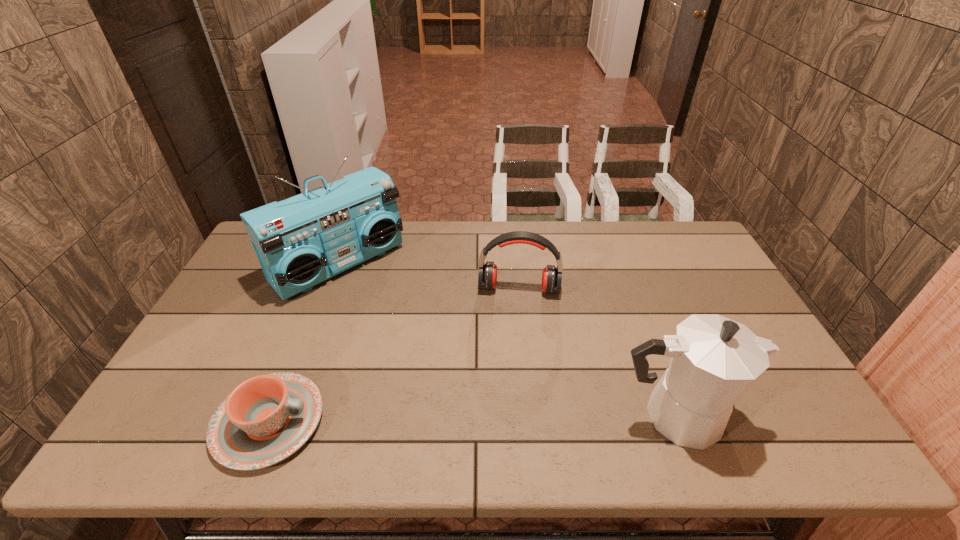
Where is `chinaware`? This screenshot has width=960, height=540. chinaware is located at coordinates (267, 418).

You are a GUI agent. You are given a task and a screenshot of the screen. Output one action in this format:
    pyautogui.click(x=<x>, y=<y>)
    Task: Click on the rightmost object
    The image size is (960, 540).
    Given the screenshot: What is the action you would take?
    pyautogui.click(x=713, y=360)

Locate an element on the screen. the second tallest object is located at coordinates (713, 360).

Where is `the third tallest object`? the third tallest object is located at coordinates (552, 276).

Image resolution: width=960 pixels, height=540 pixels. Identify the location of earphone. (552, 276).

I want to click on radio receiver, so click(x=301, y=241).

You are a GUI agent. You are given a task and a screenshot of the screen. Output one action in this format:
    pyautogui.click(x=<x>, y=<y>)
    Task: Click on the vacant space positioned at the spout of the coffeepot
    This screenshot has width=960, height=540.
    Given the screenshot: What is the action you would take?
    pyautogui.click(x=794, y=416)

Where is `vacant space situated 0.190m on the ear cups of the third object from left to right`? This screenshot has height=540, width=960. vacant space situated 0.190m on the ear cups of the third object from left to right is located at coordinates (514, 349).

This screenshot has height=540, width=960. I want to click on free space located 0.300m on the ear cups of the third object from left to right, so click(x=512, y=382).

The width and height of the screenshot is (960, 540). Identify the location of free region located 0.340m on the ear cups of the third object from left to right. [x=512, y=396].